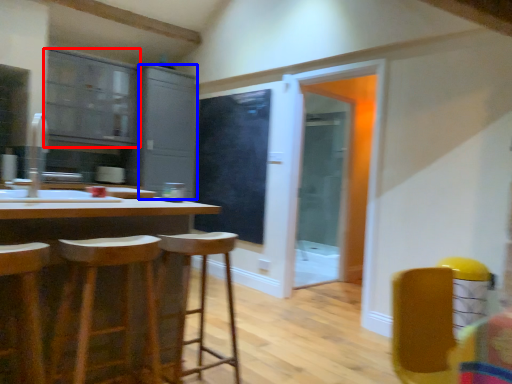
Question: Which of the following is the farthest to the observer, cabinetry (highlighted by a red box) or cabinetry (highlighted by a blue box)?

Choices:
 (A) cabinetry
 (B) cabinetry

Answer: (B)